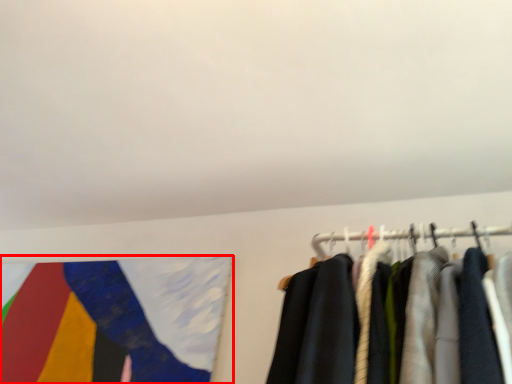
Question: Considering the relative positions of flag (annotated by the red box) and backdrop in the image provided, where is flag (annotated by the red box) located with respect to the staircase?

Choices:
 (A) left
 (B) right

Answer: (A)